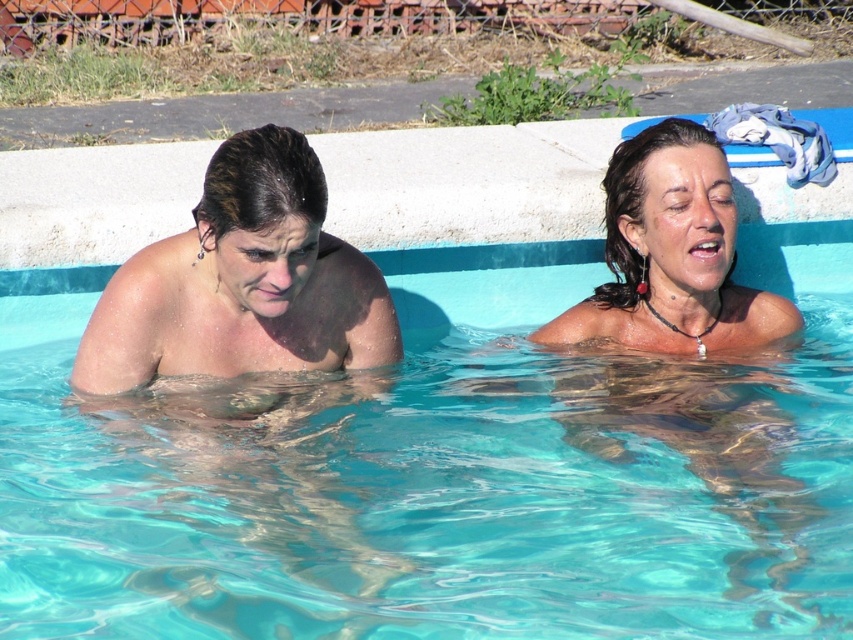
Which is more to the left, clear blue water at center or smooth skin woman at left?

smooth skin woman at left

Between point (813, 413) and point (215, 188), which one is positioned behind?

The point (813, 413) is more distant.

Does point (831, 253) come closer to viewer compared to point (146, 292)?

That is False.

The height and width of the screenshot is (640, 853). Find the location of `clear blue water at center`. clear blue water at center is located at coordinates (419, 477).

Between clear blue water at center and wet hair at upper right, which one appears on the right side from the viewer's perspective?

wet hair at upper right is more to the right.

Which is more to the left, clear blue water at center or wet hair at upper right?

clear blue water at center

Where is `clear blue water at center`? The width and height of the screenshot is (853, 640). clear blue water at center is located at coordinates (419, 477).

The width and height of the screenshot is (853, 640). Find the location of `clear blue water at center`. clear blue water at center is located at coordinates (419, 477).

Between smooth skin woman at left and wet hair at upper right, which one has less height?

With less height is smooth skin woman at left.

Is point (248, 403) more distant than point (722, 340)?

That is False.

Image resolution: width=853 pixels, height=640 pixels. I want to click on smooth skin woman at left, so click(242, 305).